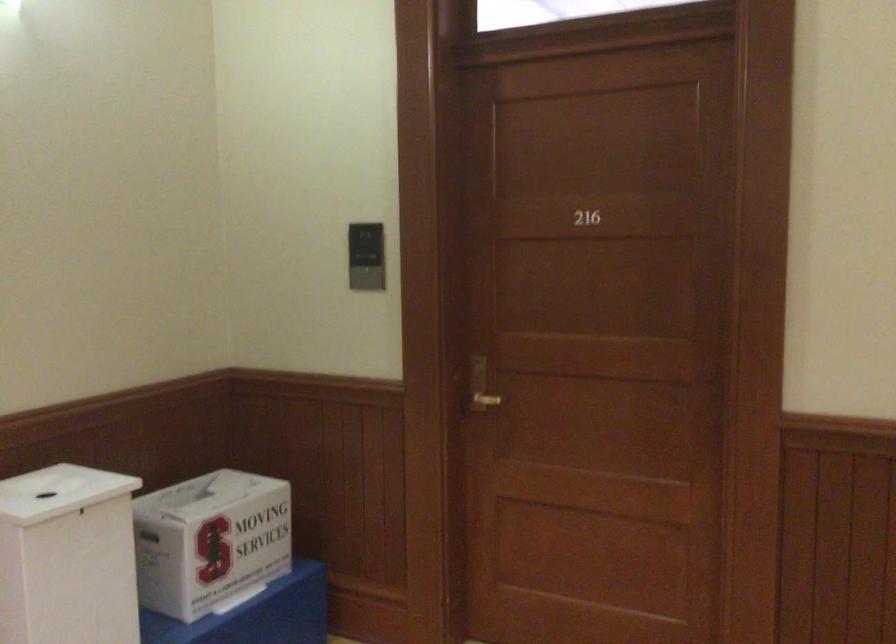
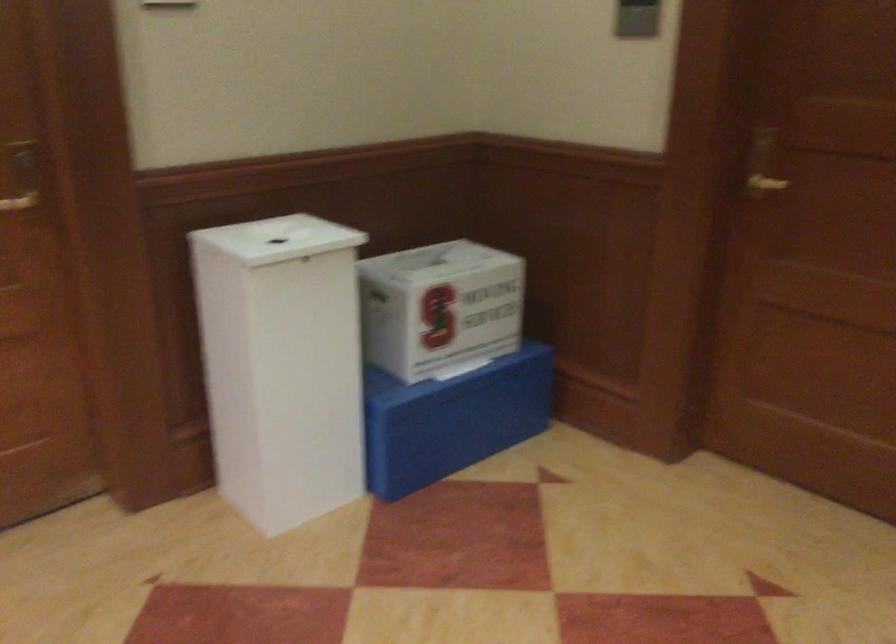
Find the pixel in the second image that matches pixel 485 382 in the first image.

(762, 164)